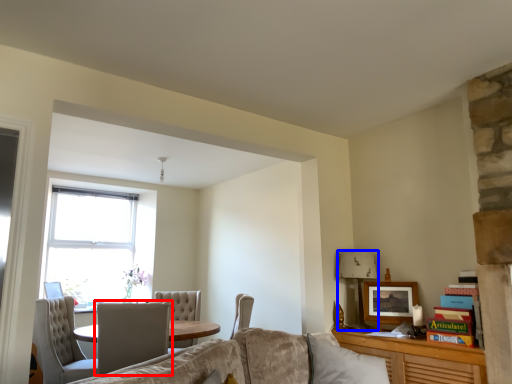
Question: Which of the following is the closest to the observer, chair (highlighted by a red box) or lamp (highlighted by a blue box)?

Choices:
 (A) chair
 (B) lamp

Answer: (A)